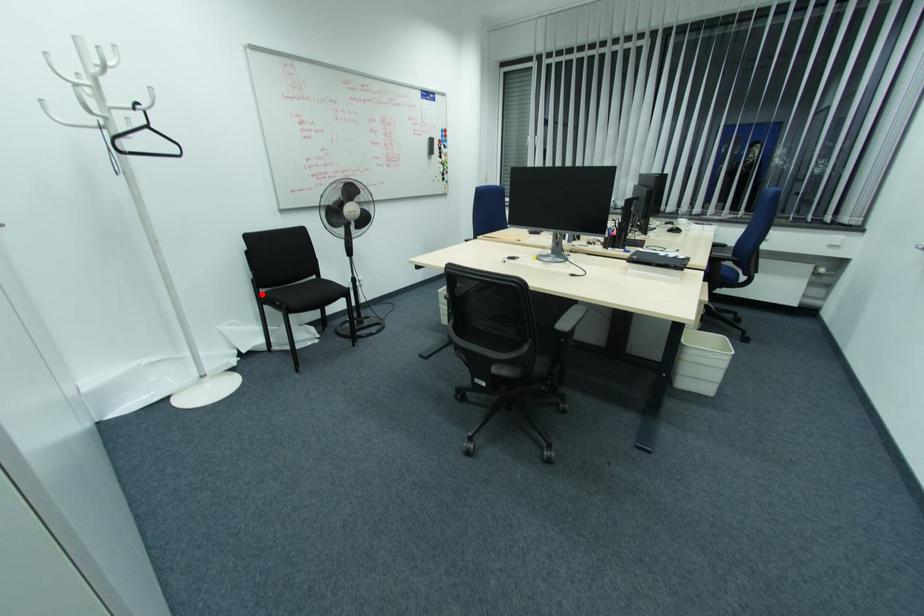
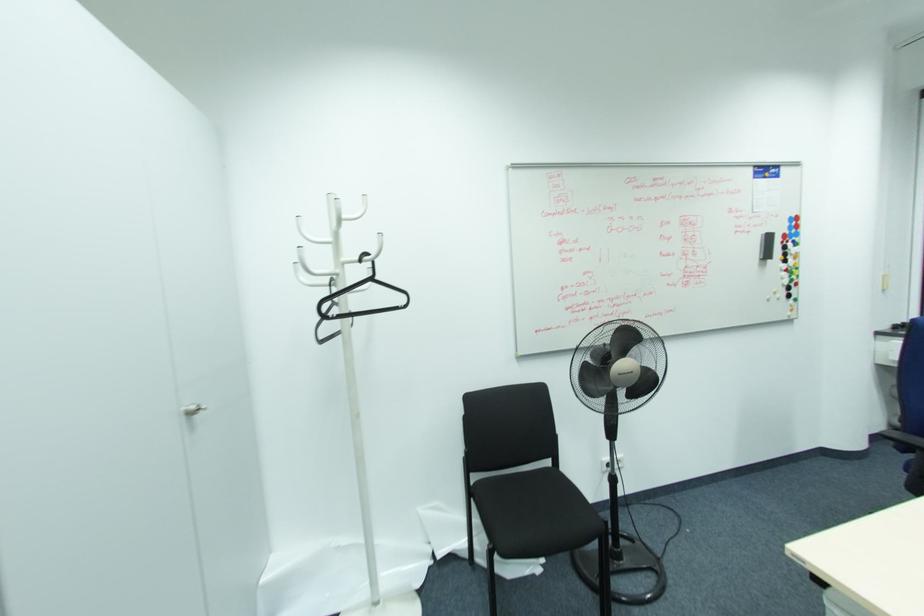
In the second image, find the point that corresponds to the highlighted location in the first image.

(472, 483)